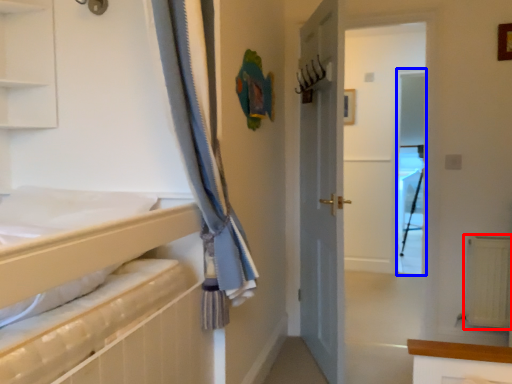
Question: Which object appears farthest to the camera in this image, radiator (highlighted by a red box) or screen door (highlighted by a blue box)?

Choices:
 (A) radiator
 (B) screen door

Answer: (B)